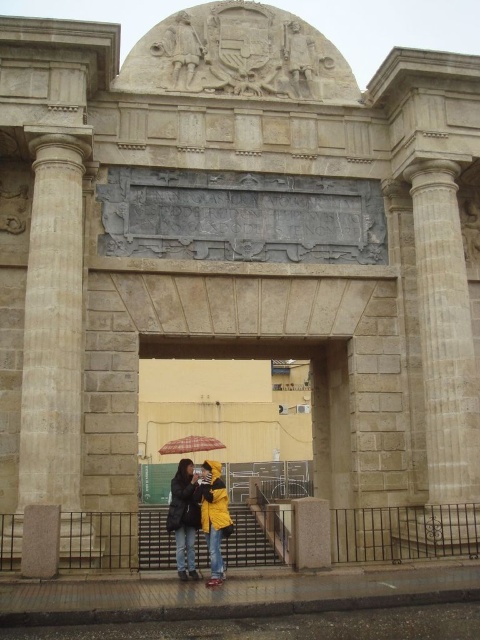
Question: Which object is closer to the camera taking this photo?

Choices:
 (A) translucent plastic umbrella at center
 (B) yellow matte jacket at center
 (C) yellow matte umbrella at center
 (D) beige stone column at right

Answer: (B)

Question: Does beige stone column at left have a lesser width compared to beige stone column at right?

Choices:
 (A) yes
 (B) no

Answer: (B)

Question: Observing the image, what is the correct spatial positioning of yellow matte umbrella at center in reference to beige stone column at right?

Choices:
 (A) above
 (B) below

Answer: (B)

Question: Which object is positioned farthest from the yellow matte umbrella at center?

Choices:
 (A) beige stone column at right
 (B) yellow matte jacket at center
 (C) beige stone column at left

Answer: (C)

Question: Which of the following is the closest to the observer?

Choices:
 (A) translucent plastic umbrella at center
 (B) yellow matte umbrella at center

Answer: (B)

Question: Observing the image, what is the correct spatial positioning of yellow matte umbrella at center in reference to translucent plastic umbrella at center?

Choices:
 (A) below
 (B) above

Answer: (B)